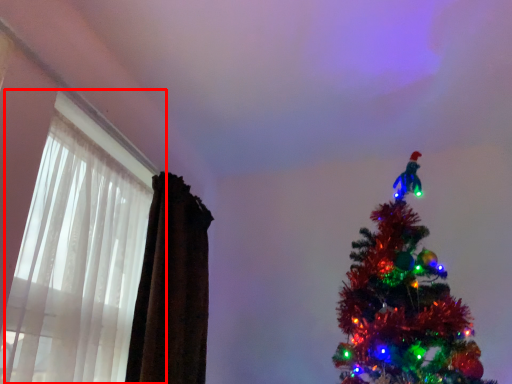
Question: From the image's perspective, where is window (annotated by the red box) located relative to curtain?

Choices:
 (A) below
 (B) above

Answer: (B)